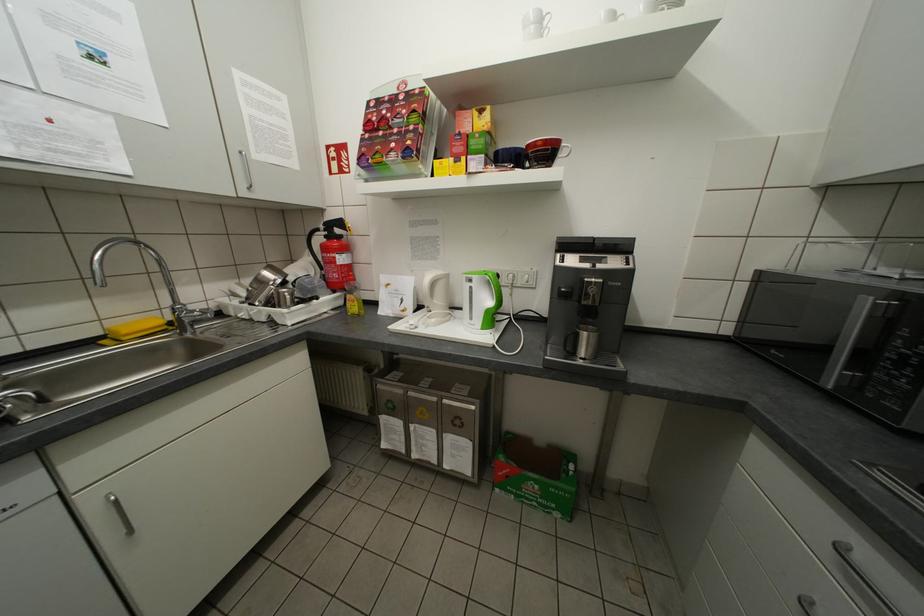
Find the location of a particular element. green cardboard box is located at coordinates (536, 475).